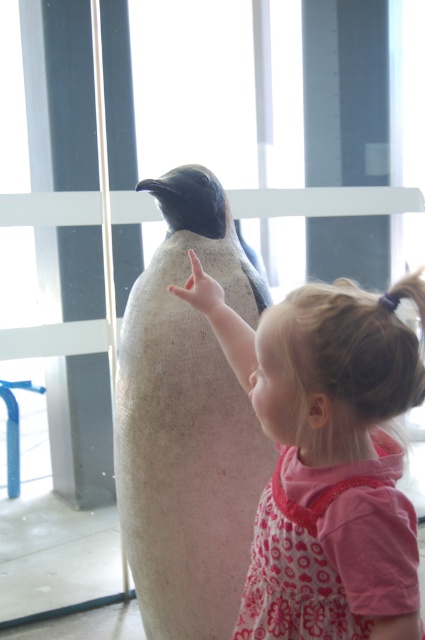
Question: Among these points, which one is nearest to the camera?

Choices:
 (A) (207, 256)
 (B) (340, 420)

Answer: (B)

Question: Can you confirm if pink fabric dress at center is wider than white matte penguin at center?

Choices:
 (A) yes
 (B) no

Answer: (A)

Question: Where is pink fabric dress at center located in relation to white matte penguin at center in the image?

Choices:
 (A) left
 (B) right

Answer: (B)

Question: Does pink fabric dress at center have a smaller size compared to white matte penguin at center?

Choices:
 (A) yes
 (B) no

Answer: (B)

Question: Among these points, which one is nearest to the camera?

Choices:
 (A) (155, 630)
 (B) (260, 371)

Answer: (B)